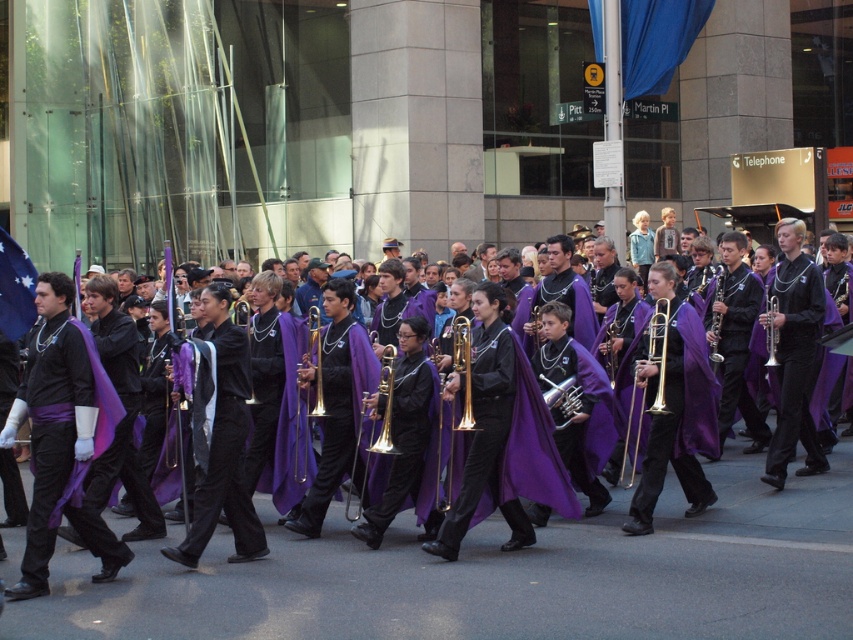
Does shiny gold trumpet at center appear over gold brass trumpet at center?

Yes.

Who is more distant from viewer, (463, 344) or (387, 401)?

The point (387, 401) is behind.

Identify the location of shiny gold trumpet at center. (463, 368).

Is point (793, 433) farther from camera compared to point (454, 332)?

Yes.

In the scene shown: Is black matte trumpet at center smaller than shiny gold trumpet at center?

No.

Who is more forward, [790,294] or [460,364]?

Point [460,364] is more forward.

This screenshot has height=640, width=853. Identify the location of black matte trumpet at center. (795, 365).

Is blue fabric flag at left thinner than silver metallic trumpet at center?

In fact, blue fabric flag at left might be wider than silver metallic trumpet at center.

Locate an element on the screen. The height and width of the screenshot is (640, 853). blue fabric flag at left is located at coordinates (15, 289).